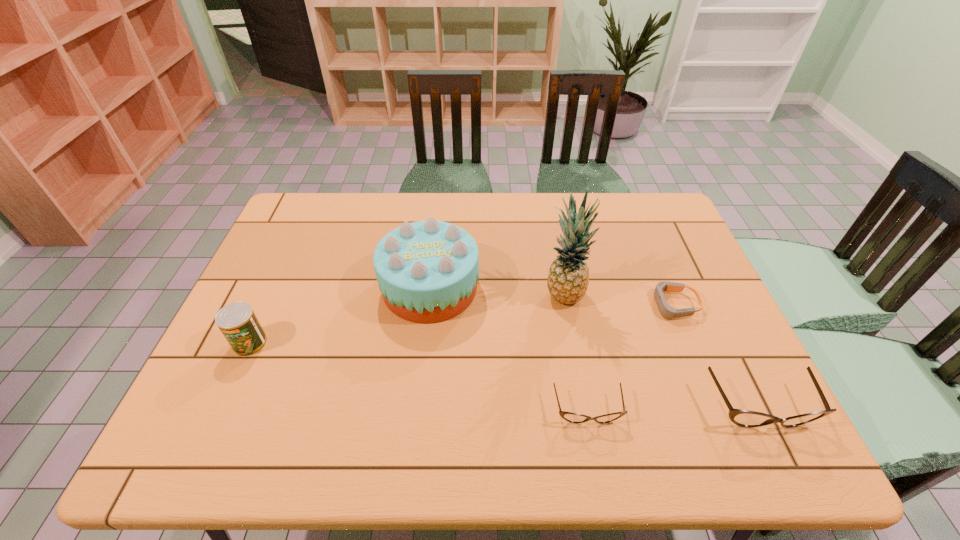
The height and width of the screenshot is (540, 960). Find the location of `vacant point located on the right of the can`. vacant point located on the right of the can is located at coordinates (346, 343).

Identify the location of free location located on the back of the pineapple. Image resolution: width=960 pixels, height=540 pixels. (550, 220).

Where is `vacant space located 0.070m on the left of the fifth shortest object`? The image size is (960, 540). vacant space located 0.070m on the left of the fifth shortest object is located at coordinates (356, 288).

Identify the location of vacant space situated on the front and back of the shortest object. (616, 305).

The image size is (960, 540). I want to click on free spot located 0.330m on the front and back of the shortest object, so (529, 305).

Where is `vacant space located on the front and back of the shortest object`? vacant space located on the front and back of the shortest object is located at coordinates (503, 305).

In order to click on object that is at the left edge in this screenshot , I will do `click(237, 321)`.

This screenshot has width=960, height=540. I want to click on spectacles present at the right edge, so click(x=744, y=418).

You are a GUI agent. You are given a task and a screenshot of the screen. Output one action in this format:
    pyautogui.click(x=<x>, y=<y>)
    Task: Click on the goggles that is positioned at the right edge
    The image size is (960, 540).
    Given the screenshot: What is the action you would take?
    pyautogui.click(x=667, y=311)

I want to click on object present at the near right corner, so click(x=744, y=418).